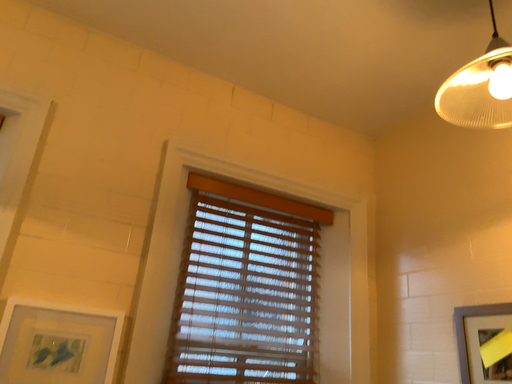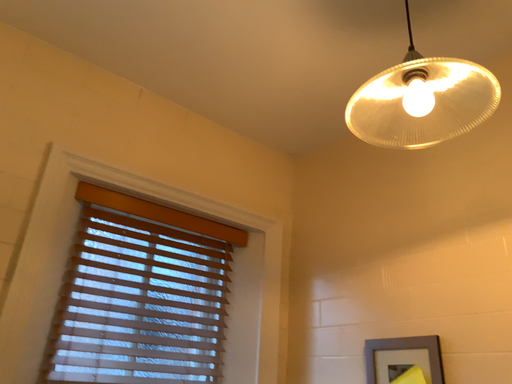
Question: How did the camera likely rotate when shooting the video?

Choices:
 (A) rotated right
 (B) rotated left

Answer: (A)